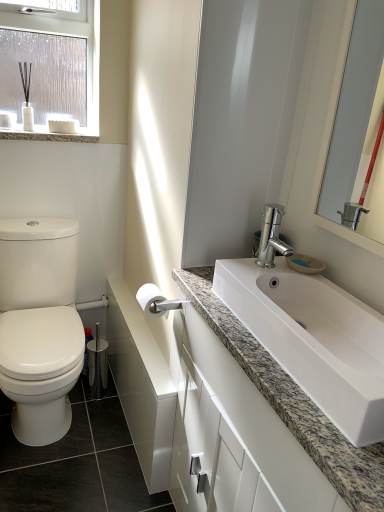
Where is `white granite sink at center`? white granite sink at center is located at coordinates (311, 332).

What do you see at coordinates (141, 384) in the screenshot? The width and height of the screenshot is (384, 512). I see `white glossy cabinet at lower center` at bounding box center [141, 384].

Describe the element at coordinates (71, 36) in the screenshot. This screenshot has width=384, height=512. I see `clear plastic window at upper left` at that location.

You are a GUI agent. You are given a task and a screenshot of the screen. Output one action in this format:
    pyautogui.click(x=<x>, y=<y>)
    Task: Click on the clear plastic window at upper left
    The image size is (384, 512).
    Given the screenshot: What is the action you would take?
    click(71, 36)

Identify the location of granite countertop at upper left. The height and width of the screenshot is (512, 384). (49, 135).

Is white glossy cabinet at lower right aimed at clear plastic window at upper left?

No.

Which is more to the right, white glossy cabinet at lower right or clear plastic window at upper left?

Positioned to the right is white glossy cabinet at lower right.

Identify the location of bathroom cabinet on the right side of clear plastic window at upper left. The image size is (384, 512). (234, 435).

Considering their positions, is white glossy cabinet at lower right located in front of or behind clear plastic window at upper left?

white glossy cabinet at lower right is in front of clear plastic window at upper left.

Looking at this image, between clear plastic window at upper left and white glossy cabinet at lower right, which one is positioned in front?

white glossy cabinet at lower right.

Are clear plastic window at upper left and white glossy cabinet at lower right making contact?

clear plastic window at upper left and white glossy cabinet at lower right are not in contact.

Is clear plastic window at upper left thinner than white glossy cabinet at lower right?

Yes.

From the image's perspective, is clear plastic window at upper left positioned above or below white glossy cabinet at lower right?

From the image's perspective, clear plastic window at upper left appears above white glossy cabinet at lower right.

Can you confirm if white glossy cabinet at lower right is positioned to the left of granite countertop at upper left?

Incorrect, white glossy cabinet at lower right is not on the left side of granite countertop at upper left.

Could you tell me if white glossy cabinet at lower right is facing granite countertop at upper left?

No, white glossy cabinet at lower right is not aimed at granite countertop at upper left.

Between white glossy cabinet at lower right and granite countertop at upper left, which one is positioned in front?

white glossy cabinet at lower right is in front.

From the image's perspective, which is above, white glossy cabinet at lower right or granite countertop at upper left?

granite countertop at upper left, from the image's perspective.

Is granite countertop at upper left oriented towards white glossy mirror at upper right?

No.

From the image's perspective, is granite countertop at upper left below white glossy mirror at upper right?

No, from the image's perspective, granite countertop at upper left is not below white glossy mirror at upper right.

In order to click on mirror above the granite countertop at upper left (from a real-world perspective) in this screenshot , I will do `click(327, 154)`.

Which is more to the right, granite countertop at upper left or white glossy mirror at upper right?

white glossy mirror at upper right.

From a real-world perspective, relative to white glossy mirror at upper right, is clear plastic window at upper left vertically above or below?

Clearly, from a real-world perspective, clear plastic window at upper left is above white glossy mirror at upper right.

Which is closer, (99, 31) or (323, 176)?

Positioned in front is point (323, 176).

Are clear plastic window at upper left and white glossy mirror at upper right located far from each other?

Yes, clear plastic window at upper left and white glossy mirror at upper right are located far from each other.

Measure the distance from granite countertop at upper left to white glossy cabinet at lower right.

A distance of 4.12 feet exists between granite countertop at upper left and white glossy cabinet at lower right.

Is granite countertop at upper left to the right of white glossy cabinet at lower right from the viewer's perspective?

No.

Is white glossy cabinet at lower right completely or partially inside granite countertop at upper left?

No, white glossy cabinet at lower right is not a part of granite countertop at upper left.

Considering the positions of points (243, 389) and (162, 404), is point (243, 389) farther from camera compared to point (162, 404)?

No, (243, 389) is closer to viewer.

Is white glossy cabinet at lower right positioned beyond the bounds of white glossy cabinet at lower center?

Yes, white glossy cabinet at lower right is outside of white glossy cabinet at lower center.

Considering the sizes of white glossy cabinet at lower right and white glossy cabinet at lower center in the image, is white glossy cabinet at lower right bigger or smaller than white glossy cabinet at lower center?

Considering their sizes, white glossy cabinet at lower right takes up more space than white glossy cabinet at lower center.

Does white glossy cabinet at lower right turn towards white glossy cabinet at lower center?

No.

Image resolution: width=384 pixels, height=512 pixels. I want to click on bathroom cabinet located underneath the clear plastic window at upper left (from a real-world perspective), so click(234, 435).

Identify the location of bathroom cabinet that is on the right side of clear plastic window at upper left. This screenshot has width=384, height=512. (234, 435).

From the image, which object appears to be nearer to white glossy cabinet at lower right, white granite sink at center or white glossy mirror at upper right?

Among the two, white granite sink at center is located nearer to white glossy cabinet at lower right.

Which object lies nearer to the anchor point clear plastic window at upper left, white granite sink at center or white matte toilet paper at center?

white matte toilet paper at center.

Which object lies nearer to the anchor point white matte toilet paper at center, clear plastic window at upper left or granite countertop at upper left?

granite countertop at upper left is positioned closer to the anchor white matte toilet paper at center.

When comparing their distances from white glossy cabinet at lower right, does white matte toilet paper at center or granite countertop at upper left seem closer?

Among the two, white matte toilet paper at center is located nearer to white glossy cabinet at lower right.

Which object lies further to the anchor point white glossy cabinet at lower right, granite countertop at upper left or clear plastic window at upper left?

clear plastic window at upper left.

Consider the image. Which object lies nearer to the anchor point granite countertop at upper left, white glossy cabinet at lower center or white granite sink at center?

white glossy cabinet at lower center is closer to granite countertop at upper left.

Estimate the real-world distances between objects in this image. Which object is closer to white matte toilet paper at center, white granite sink at center or white glossy cabinet at lower right?

white glossy cabinet at lower right is positioned closer to the anchor white matte toilet paper at center.

Consider the image. When comparing their distances from white glossy cabinet at lower center, does white granite sink at center or white matte toilet paper at center seem further?

white granite sink at center lies further to white glossy cabinet at lower center than the other object.

Find the location of a particular element. This screenshot has height=512, width=384. mirror that lies between clear plastic window at upper left and white glossy cabinet at lower right from top to bottom is located at coordinates tap(327, 154).

Locate an element on the screen. This screenshot has width=384, height=512. toilet paper between white glossy mirror at upper right and white glossy cabinet at lower right vertically is located at coordinates (151, 300).

Image resolution: width=384 pixels, height=512 pixels. Identify the location of window sill between clear plastic window at upper left and white matte toilet paper at center in the up-down direction. (49, 135).

Where is `cabinetry between granite countertop at upper left and white glossy cabinet at lower right vertically`? This screenshot has height=512, width=384. cabinetry between granite countertop at upper left and white glossy cabinet at lower right vertically is located at coordinates (141, 384).